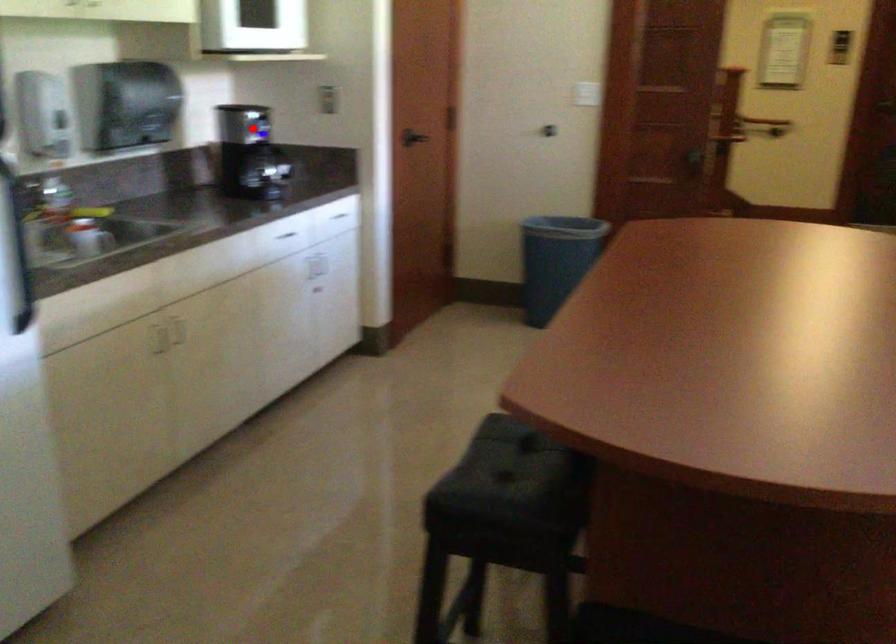
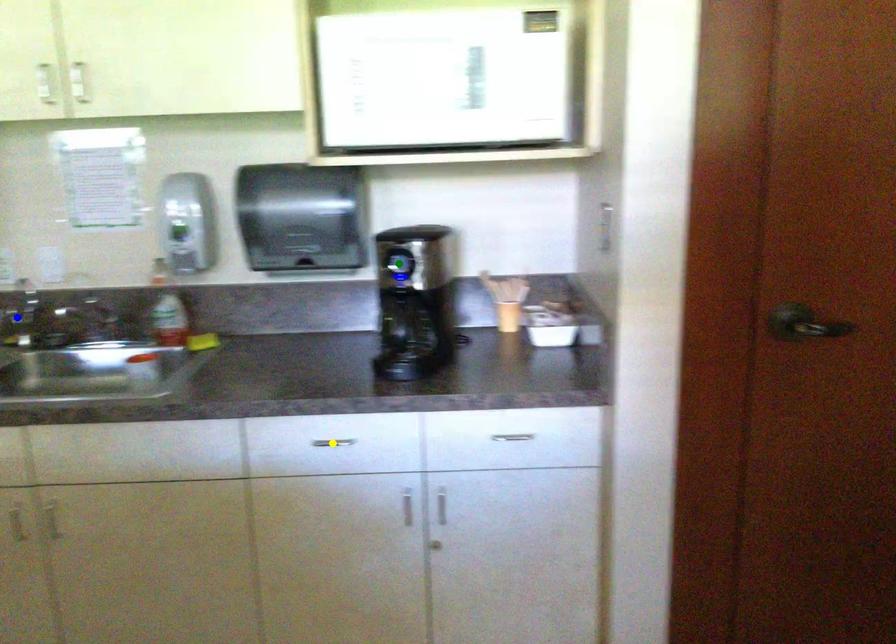
Question: I am providing you with two images of the same scene from different viewpoints. A red point is marked on the first image. You are given multiple points on the second image. Can you choose the point in image 2 that corresponds to the point in image 1?

Choices:
 (A) blue point
 (B) green point
 (C) yellow point

Answer: (B)